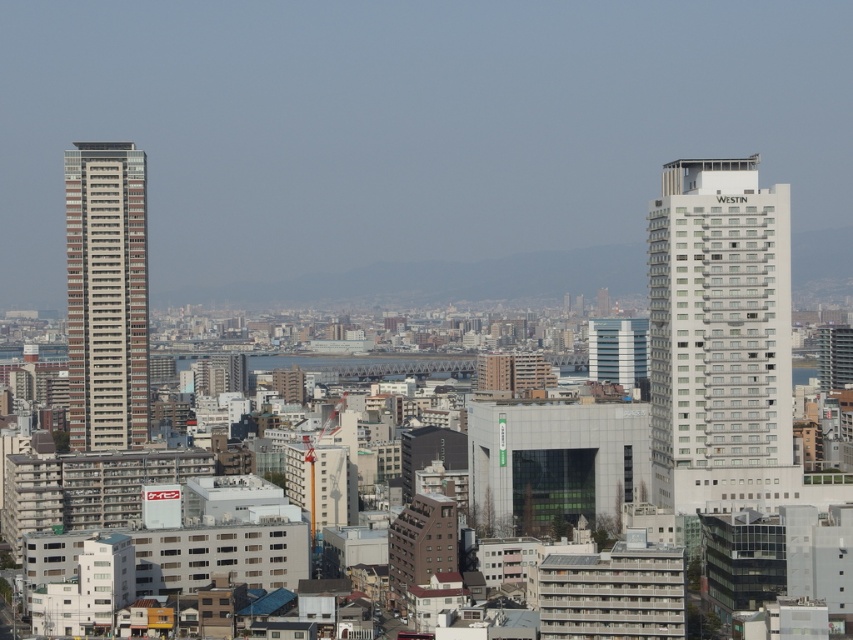
Question: Which object appears farthest from the camera in this image?

Choices:
 (A) white glossy hotel at right
 (B) brown textured building at left

Answer: (B)

Question: Which object is closer to the camera taking this photo?

Choices:
 (A) brown textured building at left
 (B) white glossy hotel at right

Answer: (B)

Question: Does white glossy hotel at right appear under brown textured building at left?

Choices:
 (A) yes
 (B) no

Answer: (A)

Question: Can you confirm if white glossy hotel at right is positioned above brown textured building at left?

Choices:
 (A) yes
 (B) no

Answer: (B)

Question: Which point is farther to the camera?

Choices:
 (A) (93, 317)
 (B) (711, 259)

Answer: (A)

Question: Is white glossy hotel at right to the right of brown textured building at left from the viewer's perspective?

Choices:
 (A) no
 (B) yes

Answer: (B)